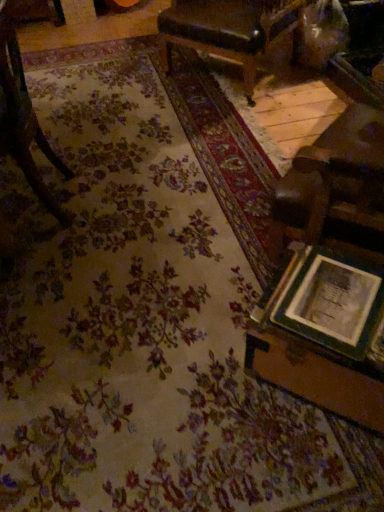
Question: Is wooden table at lower right looking in the opposite direction of wooden picture frame at lower right?

Choices:
 (A) no
 (B) yes

Answer: (A)

Question: Is wooden table at lower right placed right next to wooden picture frame at lower right?

Choices:
 (A) no
 (B) yes

Answer: (B)

Question: Would you say wooden table at lower right is a long distance from wooden picture frame at lower right?

Choices:
 (A) no
 (B) yes

Answer: (A)

Question: From a real-world perspective, is wooden table at lower right on top of wooden picture frame at lower right?

Choices:
 (A) yes
 (B) no

Answer: (B)

Question: Does wooden table at lower right have a smaller size compared to wooden picture frame at lower right?

Choices:
 (A) yes
 (B) no

Answer: (B)

Question: Is wooden table at lower right at the right side of wooden picture frame at lower right?

Choices:
 (A) yes
 (B) no

Answer: (A)

Question: Is wooden picture frame at lower right smaller than wooden table at lower right?

Choices:
 (A) yes
 (B) no

Answer: (A)

Question: Is wooden picture frame at lower right oriented towards wooden table at lower right?

Choices:
 (A) no
 (B) yes

Answer: (A)

Question: Does wooden picture frame at lower right have a greater width compared to wooden table at lower right?

Choices:
 (A) no
 (B) yes

Answer: (A)

Question: From a real-world perspective, does wooden picture frame at lower right stand above wooden table at lower right?

Choices:
 (A) yes
 (B) no

Answer: (A)

Question: From the image's perspective, does wooden picture frame at lower right appear higher than wooden table at lower right?

Choices:
 (A) no
 (B) yes

Answer: (B)

Question: Considering the relative positions of wooden picture frame at lower right and wooden table at lower right in the image provided, is wooden picture frame at lower right to the right of wooden table at lower right from the viewer's perspective?

Choices:
 (A) no
 (B) yes

Answer: (A)

Question: Are wooden chair at left, marked as the second chair in a back-to-front arrangement, and wooden picture frame at lower right far apart?

Choices:
 (A) yes
 (B) no

Answer: (A)